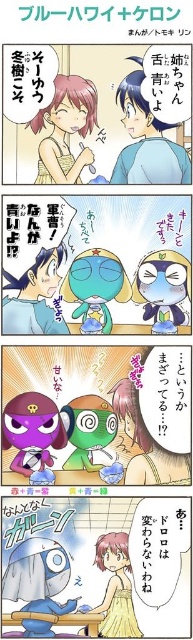
In the scene shown: In the first panel of the comic strip, you notice the matte pink hair at upper left and the matte yellow dress at lower center. Which object is taller?

The matte pink hair at upper left is taller than the matte yellow dress at lower center.

You are an observer looking at the comic strip. Which object is closer to you between the matte pink hair at upper left and the matte yellow dress at lower center?

The matte pink hair at upper left is closer to you because it is in front of the matte yellow dress at lower center.

Looking at this image, you are a tailor measuring the distance between the matte pink hair at upper left and the matte yellow dress at lower center in the first panel of the comic strip. The minimum distance required for your measuring tape to reach is 20 inches. Can you confirm if your tape measure will be sufficient?

The distance between the matte pink hair at upper left and the matte yellow dress at lower center is 21.67 inches. Since the required minimum is 20 inches, the tape measure can reach the required distance and is sufficient.